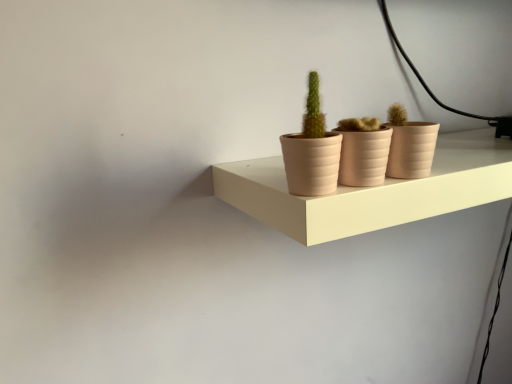
I want to click on matte pink pot at center, so click(312, 150).

What do you see at coordinates (412, 150) in the screenshot?
I see `matte pink flowerpot at center, which ranks as the second flowerpot in left-to-right order` at bounding box center [412, 150].

In order to click on matte clay flowerpot at center, which ranks as the first flowerpot in left-to-right order in this screenshot , I will do `click(364, 157)`.

Is matte clay flowerpot at center, which ranks as the 2th flowerpot in right-to-left order, aimed at matte pink flowerpot at center, which ranks as the second flowerpot in left-to-right order?

No, matte clay flowerpot at center, which ranks as the 2th flowerpot in right-to-left order, is not oriented towards matte pink flowerpot at center, which ranks as the second flowerpot in left-to-right order.

Who is smaller, matte clay flowerpot at center, which ranks as the 2th flowerpot in right-to-left order, or matte pink flowerpot at center, which ranks as the second flowerpot in left-to-right order?

Smaller between the two is matte pink flowerpot at center, which ranks as the second flowerpot in left-to-right order.

Is matte clay flowerpot at center, which ranks as the first flowerpot in left-to-right order, in front of or behind matte pink flowerpot at center, the first flowerpot viewed from the right, in the image?

Clearly, matte clay flowerpot at center, which ranks as the first flowerpot in left-to-right order, is in front of matte pink flowerpot at center, the first flowerpot viewed from the right.

Is matte clay flowerpot at center, which ranks as the first flowerpot in left-to-right order, at the left side of matte pink flowerpot at center, which ranks as the second flowerpot in left-to-right order?

Correct, you'll find matte clay flowerpot at center, which ranks as the first flowerpot in left-to-right order, to the left of matte pink flowerpot at center, which ranks as the second flowerpot in left-to-right order.

From the image's perspective, which one is positioned lower, matte beige shelf at center or matte pink pot at center?

From the image's view, matte beige shelf at center is below.

From a real-world perspective, is matte beige shelf at center physically below matte pink pot at center?

Indeed, from a real-world perspective, matte beige shelf at center is positioned beneath matte pink pot at center.

Does matte pink flowerpot at center, which ranks as the second flowerpot in left-to-right order, lie in front of matte clay flowerpot at center, which ranks as the 2th flowerpot in right-to-left order?

No, matte pink flowerpot at center, which ranks as the second flowerpot in left-to-right order, is further to the viewer.

Identify the location of flowerpot on the left of matte pink flowerpot at center, which ranks as the second flowerpot in left-to-right order. The height and width of the screenshot is (384, 512). (364, 157).

Can you confirm if matte pink flowerpot at center, the first flowerpot viewed from the right, is thinner than matte clay flowerpot at center, which ranks as the 2th flowerpot in right-to-left order?

Indeed, matte pink flowerpot at center, the first flowerpot viewed from the right, has a lesser width compared to matte clay flowerpot at center, which ranks as the 2th flowerpot in right-to-left order.

In terms of height, does matte clay flowerpot at center, which ranks as the first flowerpot in left-to-right order, look taller or shorter compared to matte pink pot at center?

In the image, matte clay flowerpot at center, which ranks as the first flowerpot in left-to-right order, appears to be shorter than matte pink pot at center.

From the image's perspective, which one is positioned higher, matte clay flowerpot at center, which ranks as the 2th flowerpot in right-to-left order, or matte pink pot at center?

matte pink pot at center appears higher in the image.

How many degrees apart are the facing directions of matte clay flowerpot at center, which ranks as the first flowerpot in left-to-right order, and matte pink pot at center?

0.000645 degrees separate the facing orientations of matte clay flowerpot at center, which ranks as the first flowerpot in left-to-right order, and matte pink pot at center.

Can you confirm if matte pink pot at center is wider than matte clay flowerpot at center, which ranks as the first flowerpot in left-to-right order?

No.

Considering the sizes of objects matte pink pot at center and matte clay flowerpot at center, which ranks as the first flowerpot in left-to-right order, in the image provided, who is shorter, matte pink pot at center or matte clay flowerpot at center, which ranks as the first flowerpot in left-to-right order,?

Standing shorter between the two is matte clay flowerpot at center, which ranks as the first flowerpot in left-to-right order.

Is matte pink pot at center facing away from matte clay flowerpot at center, which ranks as the 2th flowerpot in right-to-left order?

No, matte clay flowerpot at center, which ranks as the 2th flowerpot in right-to-left order, is not at the back of matte pink pot at center.

In the scene shown: Does matte pink pot at center lie behind matte clay flowerpot at center, which ranks as the 2th flowerpot in right-to-left order?

No, the depth of matte pink pot at center is less than that of matte clay flowerpot at center, which ranks as the 2th flowerpot in right-to-left order.

Which is further, (340, 222) or (357, 153)?

Point (357, 153)

Considering the sizes of objects matte beige shelf at center and matte clay flowerpot at center, which ranks as the first flowerpot in left-to-right order, in the image provided, who is taller, matte beige shelf at center or matte clay flowerpot at center, which ranks as the first flowerpot in left-to-right order,?

matte clay flowerpot at center, which ranks as the first flowerpot in left-to-right order.

Would you say matte beige shelf at center is inside or outside matte clay flowerpot at center, which ranks as the 2th flowerpot in right-to-left order?

matte beige shelf at center is not enclosed by matte clay flowerpot at center, which ranks as the 2th flowerpot in right-to-left order.

Is matte beige shelf at center positioned far away from matte clay flowerpot at center, which ranks as the first flowerpot in left-to-right order?

That's not correct — matte beige shelf at center is a little close to matte clay flowerpot at center, which ranks as the first flowerpot in left-to-right order.

From a real-world perspective, between matte beige shelf at center and matte pink flowerpot at center, which ranks as the second flowerpot in left-to-right order, who is vertically higher?

matte pink flowerpot at center, which ranks as the second flowerpot in left-to-right order, is physically above.

Considering the relative sizes of matte beige shelf at center and matte pink flowerpot at center, which ranks as the second flowerpot in left-to-right order, in the image provided, is matte beige shelf at center bigger than matte pink flowerpot at center, which ranks as the second flowerpot in left-to-right order,?

Correct, matte beige shelf at center is larger in size than matte pink flowerpot at center, which ranks as the second flowerpot in left-to-right order.

Image resolution: width=512 pixels, height=384 pixels. What are the coordinates of `the 2nd flowerpot located above the matte beige shelf at center (from a real-world perspective)` in the screenshot? It's located at (412, 150).

Locate an element on the screen. The height and width of the screenshot is (384, 512). flowerpot below the matte pink flowerpot at center, which ranks as the second flowerpot in left-to-right order (from a real-world perspective) is located at coordinates (364, 157).

At what (x,y) coordinates should I click in order to perform the action: click on houseplant above the matte beige shelf at center (from a real-world perspective). Please return your answer as a coordinate pair (x, y). Looking at the image, I should click on (312, 150).

Which object lies further to the anchor point matte pink pot at center, matte beige shelf at center or matte pink flowerpot at center, the first flowerpot viewed from the right?

matte beige shelf at center is positioned further to the anchor matte pink pot at center.

Based on their spatial positions, is matte clay flowerpot at center, which ranks as the first flowerpot in left-to-right order, or matte beige shelf at center closer to matte pink flowerpot at center, the first flowerpot viewed from the right?

matte clay flowerpot at center, which ranks as the first flowerpot in left-to-right order, is positioned closer to the anchor matte pink flowerpot at center, the first flowerpot viewed from the right.

In the scene shown: Looking at the image, which one is located further to matte clay flowerpot at center, which ranks as the first flowerpot in left-to-right order, matte pink flowerpot at center, which ranks as the second flowerpot in left-to-right order, or matte pink pot at center?

Among the two, matte pink flowerpot at center, which ranks as the second flowerpot in left-to-right order, is located further to matte clay flowerpot at center, which ranks as the first flowerpot in left-to-right order.

Considering their positions, is matte clay flowerpot at center, which ranks as the first flowerpot in left-to-right order, positioned further to matte pink pot at center than matte beige shelf at center?

matte beige shelf at center.

Estimate the real-world distances between objects in this image. Which object is closer to matte pink flowerpot at center, the first flowerpot viewed from the right, matte clay flowerpot at center, which ranks as the 2th flowerpot in right-to-left order, or matte pink pot at center?

matte clay flowerpot at center, which ranks as the 2th flowerpot in right-to-left order, lies closer to matte pink flowerpot at center, the first flowerpot viewed from the right, than the other object.

When comparing their distances from matte beige shelf at center, does matte pink flowerpot at center, which ranks as the second flowerpot in left-to-right order, or matte clay flowerpot at center, which ranks as the first flowerpot in left-to-right order, seem further?

Among the two, matte clay flowerpot at center, which ranks as the first flowerpot in left-to-right order, is located further to matte beige shelf at center.

Estimate the real-world distances between objects in this image. Which object is closer to matte pink flowerpot at center, the first flowerpot viewed from the right, matte beige shelf at center or matte clay flowerpot at center, which ranks as the 2th flowerpot in right-to-left order?

matte clay flowerpot at center, which ranks as the 2th flowerpot in right-to-left order, is positioned closer to the anchor matte pink flowerpot at center, the first flowerpot viewed from the right.

From the image, which object appears to be nearer to matte beige shelf at center, matte pink pot at center or matte clay flowerpot at center, which ranks as the first flowerpot in left-to-right order?

The object closer to matte beige shelf at center is matte pink pot at center.

The height and width of the screenshot is (384, 512). In order to click on flowerpot between matte pink pot at center and matte pink flowerpot at center, the first flowerpot viewed from the right, in the horizontal direction in this screenshot , I will do `click(364, 157)`.

Image resolution: width=512 pixels, height=384 pixels. Find the location of `flowerpot between matte clay flowerpot at center, which ranks as the 2th flowerpot in right-to-left order, and matte beige shelf at center, in the horizontal direction`. flowerpot between matte clay flowerpot at center, which ranks as the 2th flowerpot in right-to-left order, and matte beige shelf at center, in the horizontal direction is located at coordinates (412, 150).